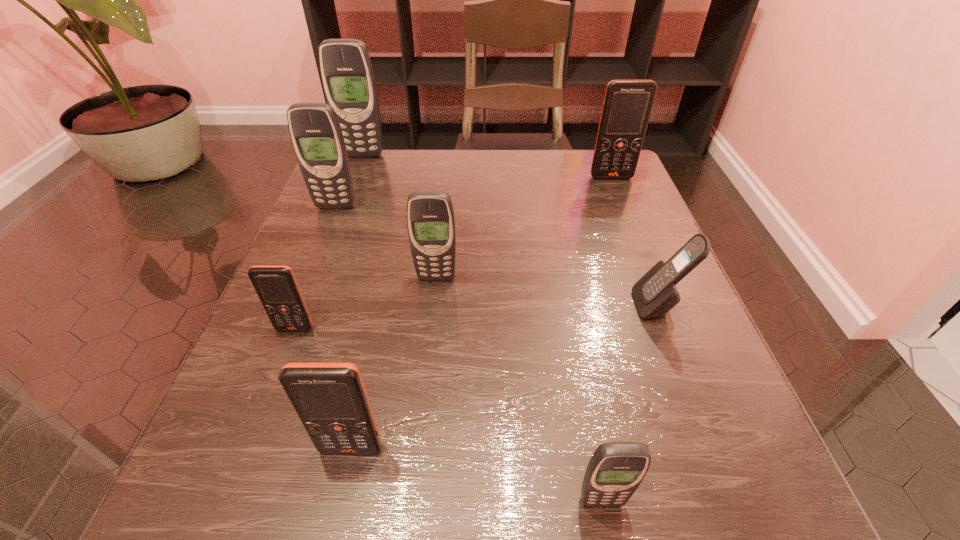
Locate which object ranks in proximity to the nearest orange cellular telephone. Please provide its 2D coordinates. Your answer should be formatted as a tuple, i.e. [(x, y)], where the tuple contains the x and y coordinates of a point satisfying the conditions above.

[(276, 286)]

Locate which object ranks third in proximity to the sixth nearest object. Please provide its 2D coordinates. Your answer should be formatted as a tuple, i.e. [(x, y)], where the tuple contains the x and y coordinates of a point satisfying the conditions above.

[(276, 286)]

Locate which cellular telephone is the third closest to the tallest cellular telephone. Please provide its 2D coordinates. Your answer should be formatted as a tuple, i.e. [(x, y)], where the tuple contains the x and y coordinates of a point satisfying the conditions above.

[(627, 106)]

You are a GUI agent. You are given a task and a screenshot of the screen. Output one action in this format:
    pyautogui.click(x=<x>, y=<y>)
    Task: Click on the cellular telephone that is the closest to the sixth farthest object
    
    Given the screenshot: What is the action you would take?
    pyautogui.click(x=430, y=216)

Image resolution: width=960 pixels, height=540 pixels. I want to click on gray cellular telephone that stands as the closest to the second gray cellular telephone from right to left, so click(x=316, y=135).

Select which gray cellular telephone is the third closest to the second biggest gray cellular telephone. Please provide its 2D coordinates. Your answer should be formatted as a tuple, i.e. [(x, y)], where the tuple contains the x and y coordinates of a point satisfying the conditions above.

[(615, 471)]

Locate which orange cellular telephone ranks third in proximity to the farthest cellular telephone. Please provide its 2D coordinates. Your answer should be formatted as a tuple, i.e. [(x, y)], where the tuple contains the x and y coordinates of a point satisfying the conditions above.

[(330, 399)]

Point out which orange cellular telephone is positioned as the second nearest to the biggest orange cellular telephone. Please provide its 2D coordinates. Your answer should be formatted as a tuple, i.e. [(x, y)], where the tuple contains the x and y coordinates of a point satisfying the conditions above.

[(330, 399)]

Where is `free point that satisfies the following two spatial constraints: 1. on the front-facing side of the fifth farthest object; 2. on the screen of the rightmost gray cellular telephone`? free point that satisfies the following two spatial constraints: 1. on the front-facing side of the fifth farthest object; 2. on the screen of the rightmost gray cellular telephone is located at coordinates (734, 501).

Locate an element on the screen. vacant area that satisfies the following two spatial constraints: 1. on the screen of the seventh nearest cellular telephone; 2. on the front-facing side of the fourth nearest object is located at coordinates (662, 305).